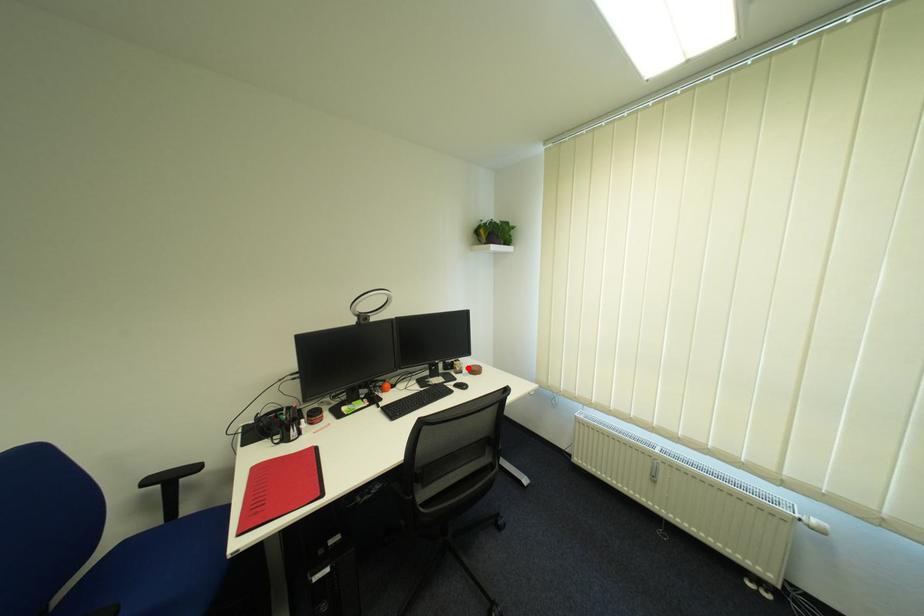
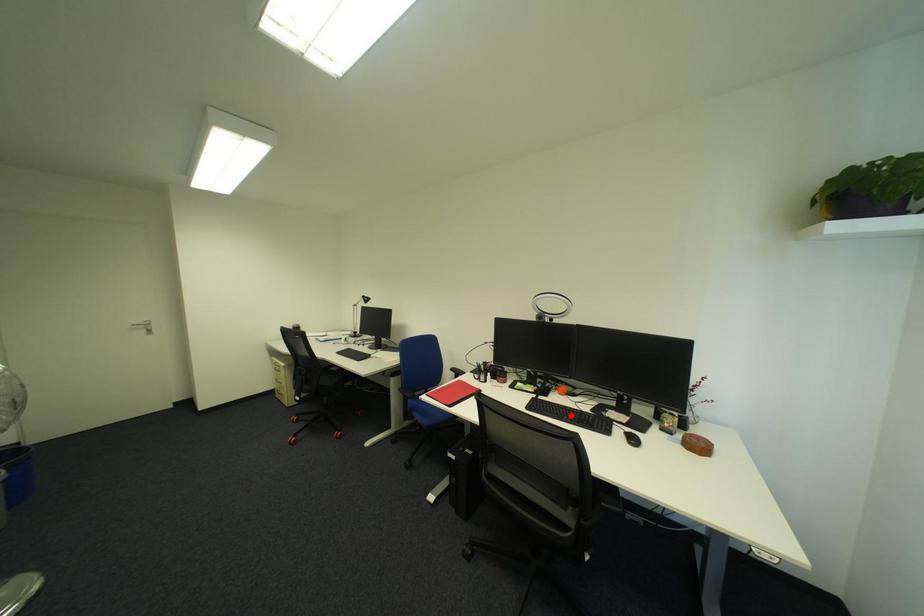
I am providing you with two images of the same scene from different viewpoints. A red point is marked on the first image and another point is marked on the second image. Are the points marked in image1 and image2 representing the same 3D position?

No